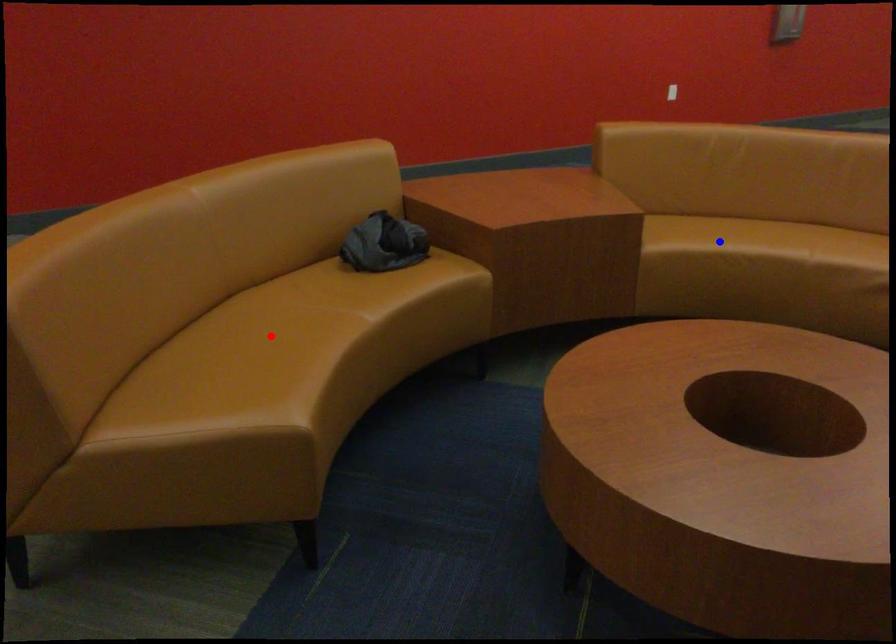
Question: Which of the two points in the image is closer to the camera?

Choices:
 (A) Blue point is closer.
 (B) Red point is closer.

Answer: (B)